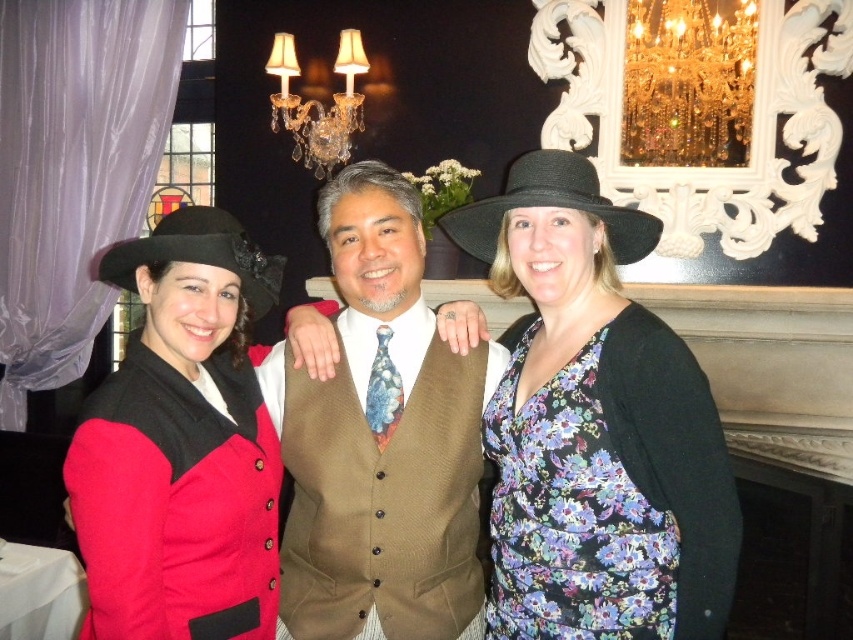
Who is more forward, (506, 241) or (119, 246)?

Point (119, 246) is more forward.

Does point (517, 461) lie in front of point (190, 259)?

No, (517, 461) is further to viewer.

Describe the element at coordinates (595, 428) in the screenshot. This screenshot has width=853, height=640. I see `floral fabric dress at center` at that location.

At what (x,y) coordinates should I click in order to perform the action: click on floral fabric dress at center. Please return your answer as a coordinate pair (x, y). This screenshot has width=853, height=640. Looking at the image, I should click on (595, 428).

Between black felt hat at left and crystal glass chandelier at upper center, which one is positioned lower?

Positioned lower is black felt hat at left.

Can you confirm if black felt hat at left is bigger than crystal glass chandelier at upper center?

No.

Does point (183, 212) lie in front of point (310, 108)?

Yes, point (183, 212) is in front of point (310, 108).

Find the location of a particular element. This screenshot has height=640, width=853. black felt hat at left is located at coordinates (198, 253).

In the scene shown: Is brown textured vest at center above floral print fabric dress at center?

Yes, brown textured vest at center is above floral print fabric dress at center.

Does point (482, 616) lie in front of point (622, 515)?

No, (482, 616) is further to viewer.

At what (x,y) coordinates should I click in order to perform the action: click on brown textured vest at center. Please return your answer as a coordinate pair (x, y). The width and height of the screenshot is (853, 640). Looking at the image, I should click on (383, 436).